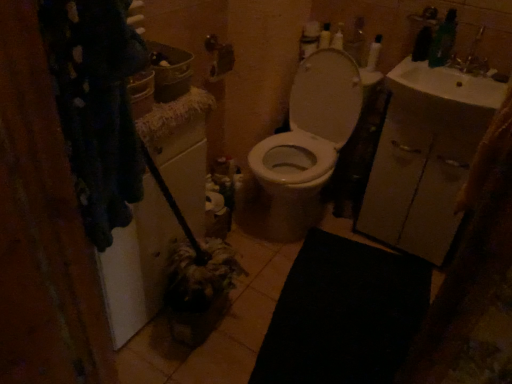
Question: Is white glossy sink at upper right positioned behind white glossy bottle at upper right?

Choices:
 (A) no
 (B) yes

Answer: (A)

Question: Considering the relative sizes of white glossy sink at upper right and white glossy bottle at upper right in the image provided, is white glossy sink at upper right shorter than white glossy bottle at upper right?

Choices:
 (A) yes
 (B) no

Answer: (A)

Question: Does white glossy sink at upper right have a greater height compared to white glossy bottle at upper right?

Choices:
 (A) yes
 (B) no

Answer: (B)

Question: Does white glossy sink at upper right have a smaller size compared to white glossy bottle at upper right?

Choices:
 (A) no
 (B) yes

Answer: (A)

Question: Is white glossy sink at upper right to the left of white glossy bottle at upper right from the viewer's perspective?

Choices:
 (A) yes
 (B) no

Answer: (B)

Question: In terms of height, does white glossy sink at upper right look taller or shorter compared to white glossy toilet at center?

Choices:
 (A) short
 (B) tall

Answer: (A)

Question: Considering their positions, is white glossy sink at upper right located in front of or behind white glossy toilet at center?

Choices:
 (A) front
 (B) behind

Answer: (A)

Question: Does point (419, 84) appear closer or farther from the camera than point (292, 226)?

Choices:
 (A) farther
 (B) closer

Answer: (B)

Question: Visually, is white glossy sink at upper right positioned to the left or to the right of white glossy toilet at center?

Choices:
 (A) left
 (B) right

Answer: (B)

Question: Is point (374, 41) closer or farther from the camera than point (269, 162)?

Choices:
 (A) closer
 (B) farther

Answer: (A)

Question: In terms of size, does white glossy bottle at upper right appear bigger or smaller than white glossy toilet at center?

Choices:
 (A) big
 (B) small

Answer: (B)

Question: Looking at their shapes, would you say white glossy bottle at upper right is wider or thinner than white glossy toilet at center?

Choices:
 (A) thin
 (B) wide

Answer: (A)

Question: From their relative heights in the image, would you say white glossy bottle at upper right is taller or shorter than white glossy toilet at center?

Choices:
 (A) tall
 (B) short

Answer: (B)

Question: In terms of width, does white glossy toilet at center look wider or thinner when compared to white glossy sink at upper right?

Choices:
 (A) wide
 (B) thin

Answer: (A)

Question: From a real-world perspective, is white glossy toilet at center physically located above or below white glossy sink at upper right?

Choices:
 (A) below
 (B) above

Answer: (A)